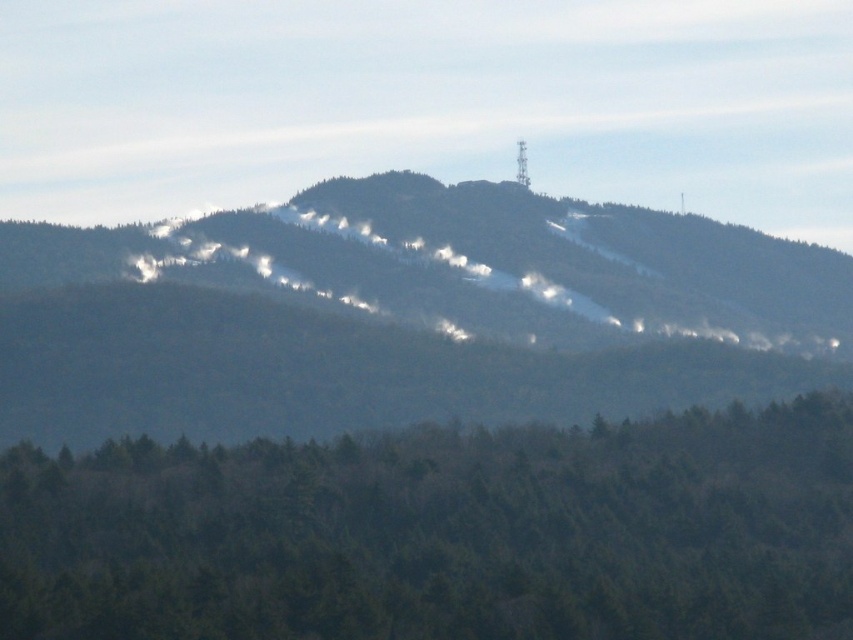
Is snowy forested mountain at center taller than green matte trees at lower center?

Correct, snowy forested mountain at center is much taller as green matte trees at lower center.

Can you confirm if snowy forested mountain at center is wider than green matte trees at lower center?

Correct, the width of snowy forested mountain at center exceeds that of green matte trees at lower center.

The width and height of the screenshot is (853, 640). What are the coordinates of `snowy forested mountain at center` in the screenshot? It's located at (405, 314).